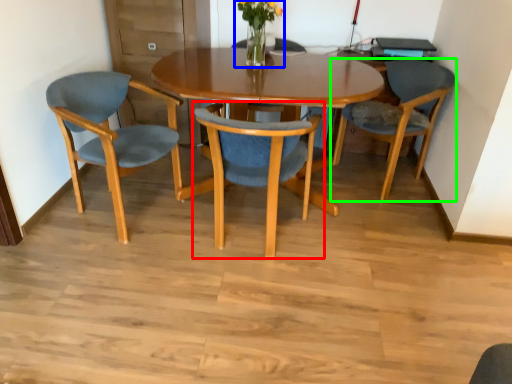
Question: Considering the real-world distances, which object is closest to chair (highlighted by a red box)? floral arrangement (highlighted by a blue box) or chair (highlighted by a green box).

Choices:
 (A) floral arrangement
 (B) chair

Answer: (A)